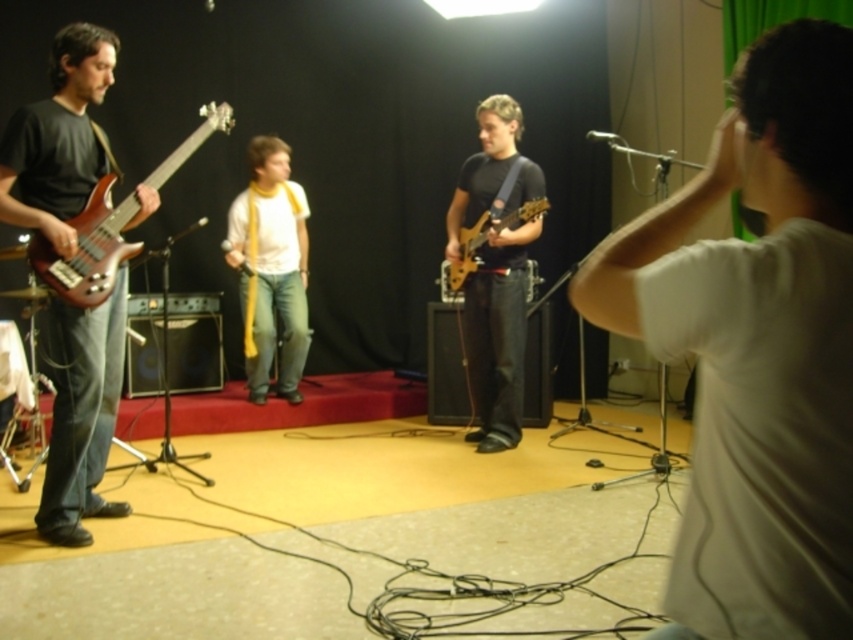
Question: Does matte black bass guitar at left have a greater width compared to glossy wood electric guitar at center?

Choices:
 (A) yes
 (B) no

Answer: (B)

Question: Based on their relative distances, which object is nearer to the matte black bass guitar at left?

Choices:
 (A) wooden glossy bass guitar at left
 (B) matte black guitar at center
 (C) glossy wood electric guitar at center

Answer: (A)

Question: Which of the following is the farthest from the observer?

Choices:
 (A) matte black bass guitar at left
 (B) matte black guitar at center
 (C) yellow fabric scarf at center

Answer: (C)

Question: Can you confirm if white matte t-shirt at center is positioned above glossy wood electric guitar at center?

Choices:
 (A) no
 (B) yes

Answer: (A)

Question: Can you confirm if matte black bass guitar at left is wider than yellow fabric scarf at center?

Choices:
 (A) no
 (B) yes

Answer: (B)

Question: Among these objects, which one is farthest from the camera?

Choices:
 (A) matte black guitar at center
 (B) wooden glossy bass guitar at left
 (C) glossy wood electric guitar at center

Answer: (A)